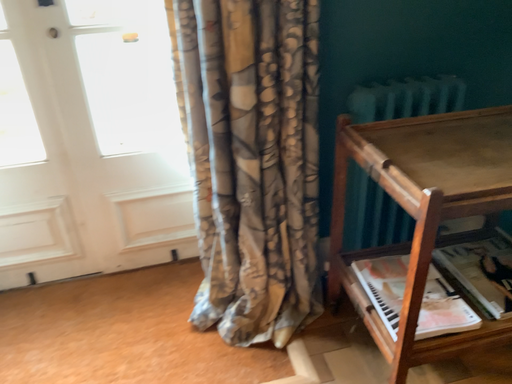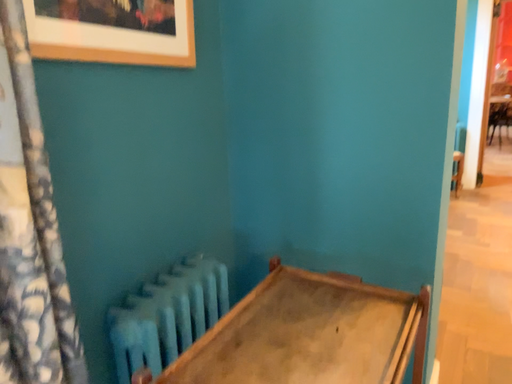
Question: How did the camera likely rotate when shooting the video?

Choices:
 (A) rotated right
 (B) rotated left

Answer: (A)